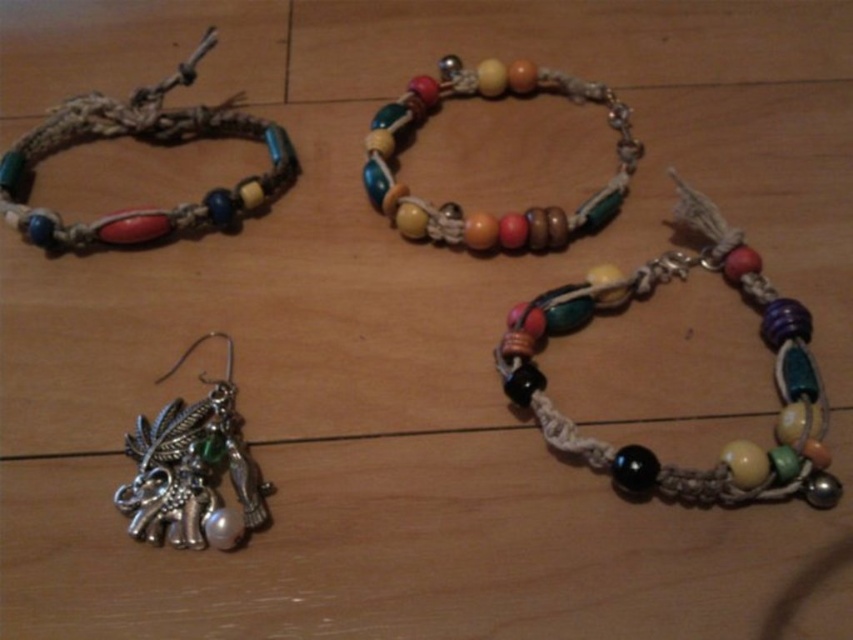
Question: Among these points, which one is farthest from the camera?

Choices:
 (A) pyautogui.click(x=154, y=112)
 (B) pyautogui.click(x=433, y=237)
 (C) pyautogui.click(x=785, y=364)

Answer: (A)

Question: Among these objects, which one is farthest from the camera?

Choices:
 (A) multicolored beads at center
 (B) wooden beads necklace at upper center

Answer: (B)

Question: Among these points, which one is farthest from the camera?

Choices:
 (A) (596, 220)
 (B) (173, 77)
 (C) (815, 476)

Answer: (B)

Question: Is the position of multicolored beads at center less distant than that of wooden beads necklace at upper center?

Choices:
 (A) no
 (B) yes

Answer: (B)

Question: Is matte woven bracelet at upper left positioned behind wooden beads necklace at upper center?

Choices:
 (A) yes
 (B) no

Answer: (B)

Question: Is matte woven bracelet at upper left bigger than wooden beads necklace at upper center?

Choices:
 (A) yes
 (B) no

Answer: (A)